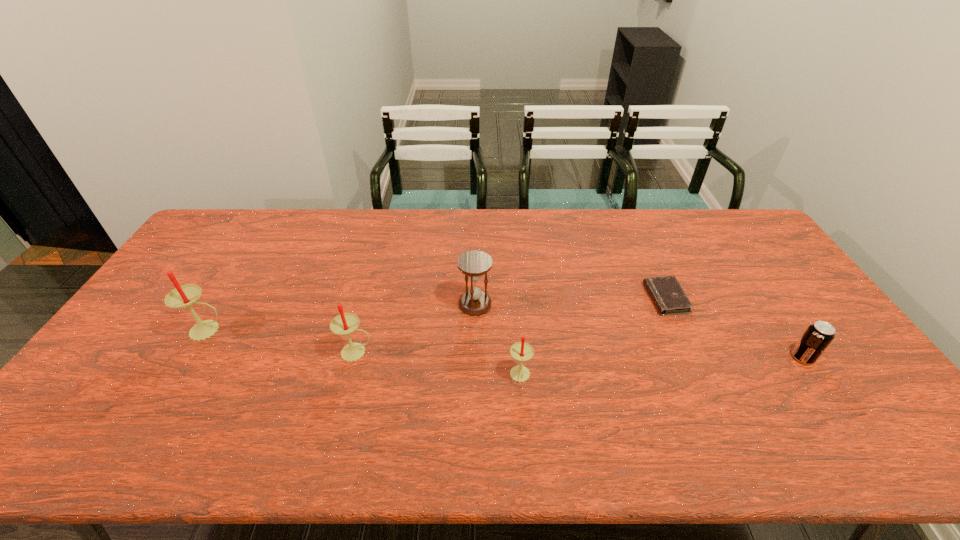
Identify the location of vacant space at the near edge of the desktop. This screenshot has height=540, width=960. (752, 389).

Where is `free space at the left edge of the desktop`? This screenshot has width=960, height=540. free space at the left edge of the desktop is located at coordinates (180, 311).

I want to click on vacant space at the right edge of the desktop, so click(756, 293).

Locate an element on the screen. Image resolution: width=960 pixels, height=540 pixels. vacant space at the far left corner is located at coordinates (222, 234).

You are a GUI agent. You are given a task and a screenshot of the screen. Output one action in this format:
    pyautogui.click(x=<x>, y=<y>)
    Task: Click on the vacant space at the near right corner
    This screenshot has height=540, width=960.
    Given the screenshot: What is the action you would take?
    pyautogui.click(x=852, y=384)

You are a GUI agent. You are given a task and a screenshot of the screen. Output one action in this format:
    pyautogui.click(x=<x>, y=<y>)
    Task: Click on the vacant area that lies between the hourglass and the soda can
    This screenshot has width=960, height=540.
    Given the screenshot: What is the action you would take?
    pyautogui.click(x=638, y=330)

You are a GUI agent. You are given a task and a screenshot of the screen. Output one action in this format:
    pyautogui.click(x=<x>, y=<y>)
    Task: Click on the free space between the fourth object from left to right and the rightmost object
    
    Given the screenshot: What is the action you would take?
    pyautogui.click(x=661, y=367)

This screenshot has width=960, height=540. In order to click on vacant area that lies between the shortest candle and the fourth object from right to left in this screenshot , I will do `click(497, 340)`.

Locate an element on the screen. The image size is (960, 540). free space between the leftmost object and the second object from left to right is located at coordinates (282, 341).

Find the location of a particular element. The image size is (960, 540). free area in between the shortest object and the second candle from right to left is located at coordinates (511, 325).